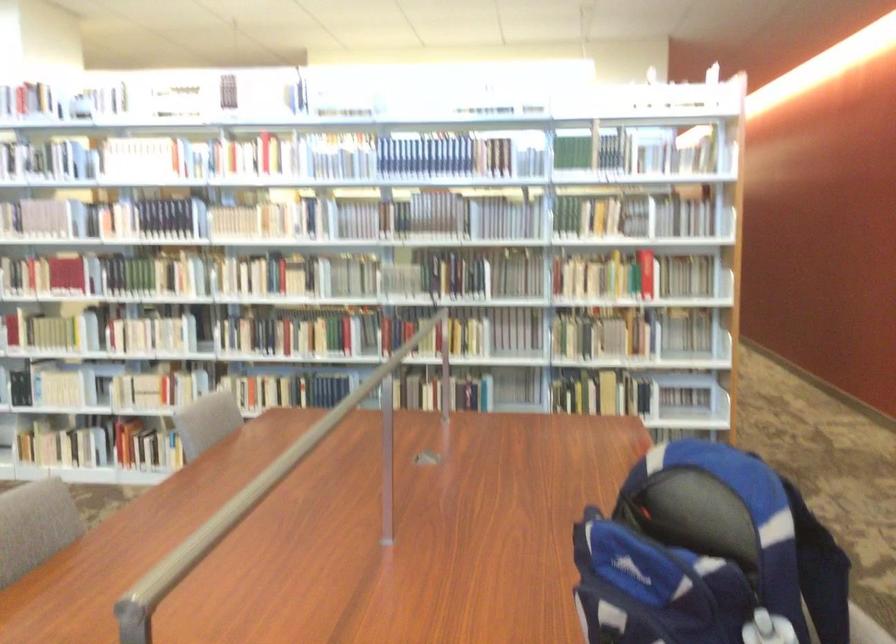
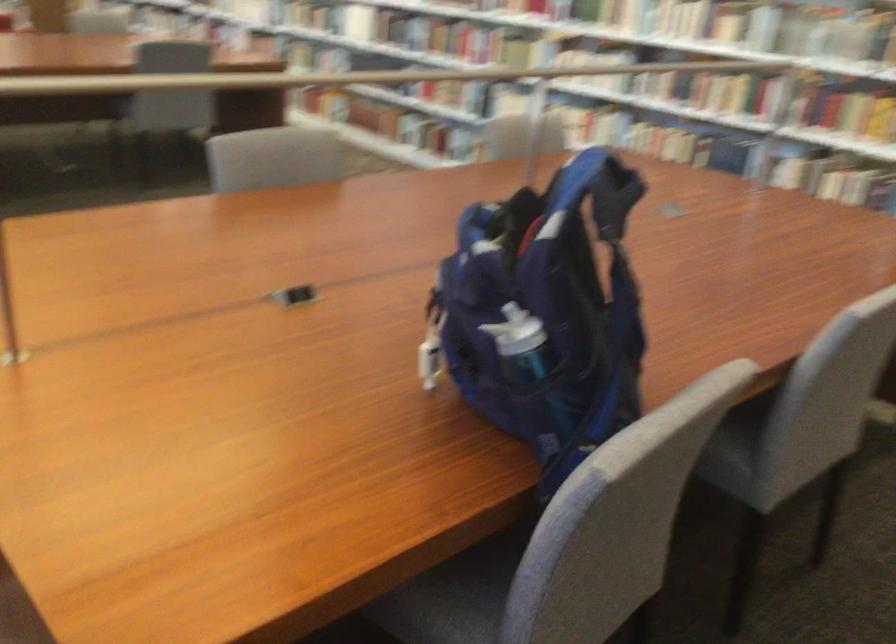
The first image is from the beginning of the video and the second image is from the end. How did the camera likely rotate when shooting the video?

The rotation direction of the camera is left-down.